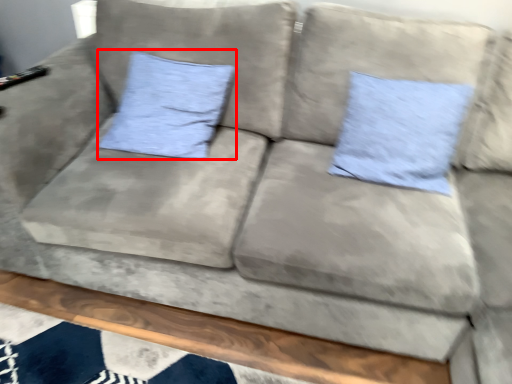
Question: From the image's perspective, considering the relative positions of pillow (annotated by the red box) and pillow in the image provided, where is pillow (annotated by the red box) located with respect to the staircase?

Choices:
 (A) above
 (B) below

Answer: (A)